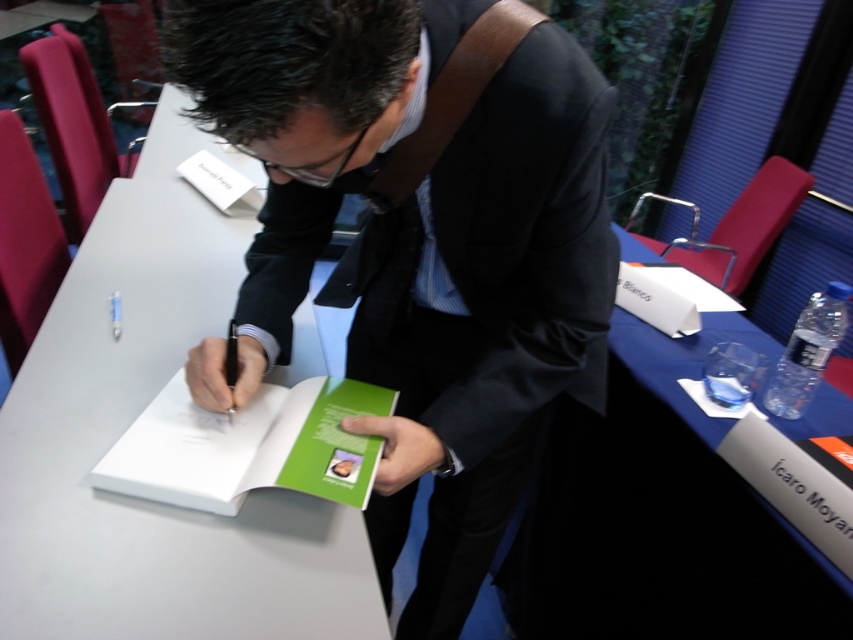
What are the coordinates of the matte black suit at center in the image?

The coordinates of the matte black suit at center are at point (419, 240).

You are organizing a book signing event and need to place a blue water bottle on the table such that it is to the right of the green matte book at center. Based on the current setup, where should you position the blue water bottle?

The green matte book at center is located at point (x=248, y=445). To place the blue water bottle to the right of it, position it at a coordinate with a higher x value than 0.698 while maintaining the same y coordinate of 0.292.